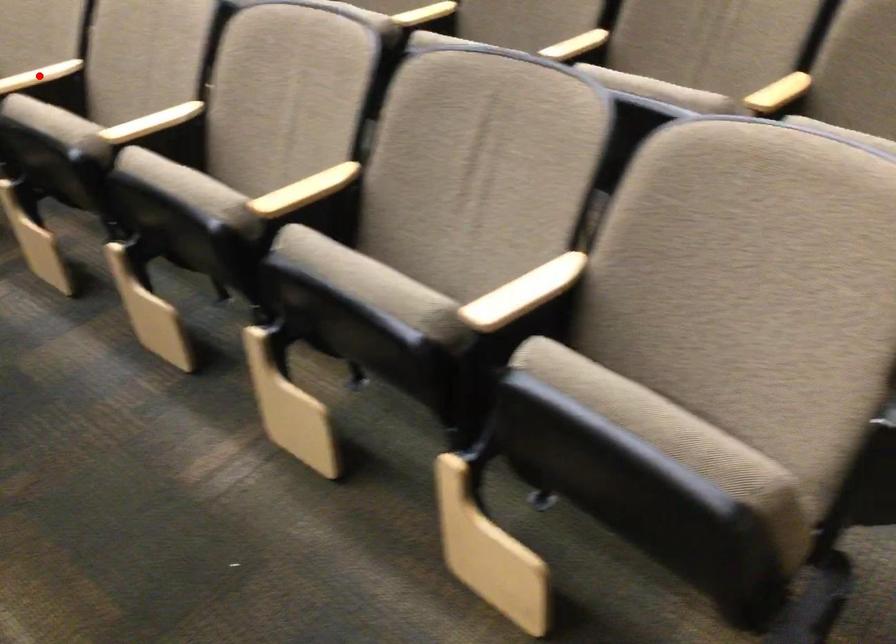
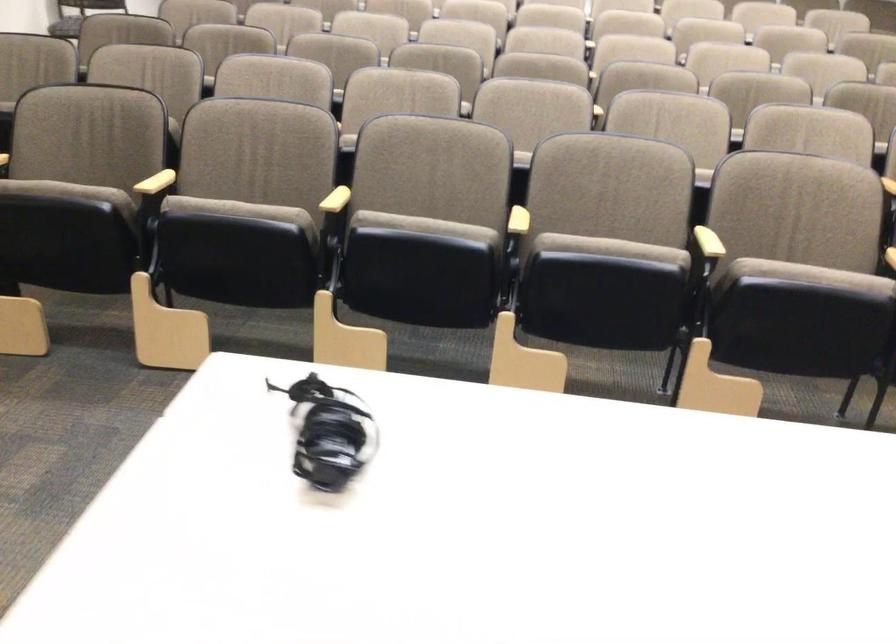
Question: I am providing you with two images of the same scene from different viewpoints. A red point is marked on the first image. Can you still see the location of the red point in image 2?

Choices:
 (A) Yes
 (B) No

Answer: (B)